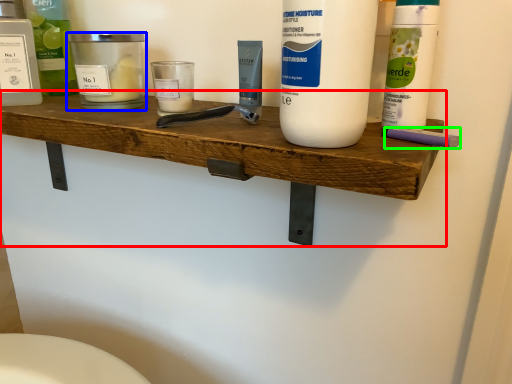
Question: Based on their relative distances, which object is farther from shelf (highlighted by a red box)? Choose from personal care (highlighted by a blue box) and personal care (highlighted by a green box).

Choices:
 (A) personal care
 (B) personal care

Answer: (B)